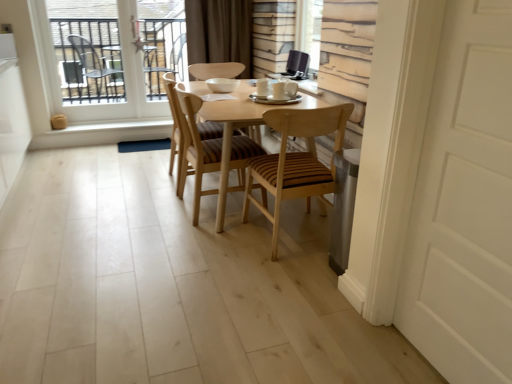
Locate an element on the screen. This screenshot has height=384, width=512. brown fabric curtain at upper center is located at coordinates (220, 32).

What do you see at coordinates (295, 161) in the screenshot? The height and width of the screenshot is (384, 512). I see `wooden striped chair at center, marked as the third chair in a left-to-right arrangement` at bounding box center [295, 161].

You are a GUI agent. You are given a task and a screenshot of the screen. Output one action in this format:
    pyautogui.click(x=<x>, y=<y>)
    Task: Click on the wooden table at center
    
    Given the screenshot: What is the action you would take?
    pyautogui.click(x=232, y=131)

The image size is (512, 384). I want to click on white matte door at center, so click(x=464, y=204).

What do you see at coordinates (309, 30) in the screenshot?
I see `wooden slats at upper center` at bounding box center [309, 30].

Locate an element on the screen. Image resolution: width=512 pixels, height=384 pixels. woodenchair at center, placed as the 2th chair when sorted from left to right is located at coordinates (198, 147).

Considering the sizes of objects brown fabric curtain at upper center and white matte door at center in the image provided, who is bigger, brown fabric curtain at upper center or white matte door at center?

With larger size is brown fabric curtain at upper center.

Is brown fabric curtain at upper center oriented away from white matte door at center?

That's not correct — brown fabric curtain at upper center is not looking away from white matte door at center.

Which object is closer to the camera taking this photo, brown fabric curtain at upper center or white matte door at center?

white matte door at center is closer to the camera.

From a real-world perspective, is brown fabric curtain at upper center physically above white matte door at center?

Indeed, from a real-world perspective, brown fabric curtain at upper center stands above white matte door at center.

From a real-world perspective, does wooden striped chair at center, the 1th chair when ordered from right to left, sit lower than clear glass window at upper left?

Correct, in the physical world, wooden striped chair at center, the 1th chair when ordered from right to left, is lower than clear glass window at upper left.

Between wooden striped chair at center, the 1th chair when ordered from right to left, and clear glass window at upper left, which one has more height?

clear glass window at upper left is taller.

From the image's perspective, is clear glass window at upper left on top of wooden slats at upper center?

Yes.

Is clear glass window at upper left oriented away from wooden slats at upper center?

clear glass window at upper left is not turned away from wooden slats at upper center.

Between clear glass window at upper left and wooden slats at upper center, which one is positioned behind?

clear glass window at upper left is more distant.

From a real-world perspective, is clear glass window at upper left positioned above or below wooden slats at upper center?

Clearly, from a real-world perspective, clear glass window at upper left is below wooden slats at upper center.

From a real-world perspective, is white matte door at center positioned under wooden slats at upper center based on gravity?

Correct, in the physical world, white matte door at center is lower than wooden slats at upper center.

Is white matte door at center oriented away from wooden slats at upper center?

That's not correct — white matte door at center is not looking away from wooden slats at upper center.

Is white matte door at center beside wooden slats at upper center?

No, white matte door at center is not making contact with wooden slats at upper center.

Locate an element on the screen. door in front of the wooden slats at upper center is located at coordinates (464, 204).

Is clear glass window at upper left looking in the opposite direction of brown fabric curtain at upper center?

That's not correct — clear glass window at upper left is not looking away from brown fabric curtain at upper center.

Is clear glass window at upper left far from brown fabric curtain at upper center?

No, clear glass window at upper left is not far from brown fabric curtain at upper center.

Considering the positions of objects clear glass window at upper left and brown fabric curtain at upper center in the image provided, who is more to the left, clear glass window at upper left or brown fabric curtain at upper center?

Positioned to the left is clear glass window at upper left.

Is clear glass window at upper left spatially inside brown fabric curtain at upper center, or outside of it?

clear glass window at upper left exists outside the volume of brown fabric curtain at upper center.

Is the surface of wooden slats at upper center in direct contact with woodenchair at center, placed as the 2th chair when sorted from left to right?

There is a gap between wooden slats at upper center and woodenchair at center, placed as the 2th chair when sorted from left to right.

From a real-world perspective, is wooden slats at upper center physically below woodenchair at center, the 2th chair from the right?

Incorrect, from a real-world perspective, wooden slats at upper center is higher than woodenchair at center, the 2th chair from the right.

Could you tell me if woodenchair at center, the 2th chair from the right, is facing wooden slats at upper center?

No, woodenchair at center, the 2th chair from the right, is not facing towards wooden slats at upper center.

Relative to wooden slats at upper center, is woodenchair at center, placed as the 2th chair when sorted from left to right, in front or behind?

Visually, woodenchair at center, placed as the 2th chair when sorted from left to right, is located in front of wooden slats at upper center.

At what (x,y) coordinates should I click in order to perform the action: click on chair that is the 2nd one when counting forward from the wooden slats at upper center. Please return your answer as a coordinate pair (x, y). The width and height of the screenshot is (512, 384). Looking at the image, I should click on [x=198, y=147].

Between woodenchair at center, the 2th chair from the right, and wooden slats at upper center, which one has smaller size?

With smaller size is wooden slats at upper center.

The width and height of the screenshot is (512, 384). I want to click on door below the brown fabric curtain at upper center (from a real-world perspective), so click(464, 204).

Image resolution: width=512 pixels, height=384 pixels. I want to click on window on the left of wooden striped chair at center, the 1th chair when ordered from right to left, so click(98, 78).

Looking at this image, looking at the image, which one is located closer to wooden slats at upper center, brown fabric curtain at upper center or white matte door at center?

The object closer to wooden slats at upper center is brown fabric curtain at upper center.

Considering their positions, is woodenchair at center, the 2th chair from the right, positioned further to brown fabric curtain at upper center than wooden striped chair at center, the 1th chair when ordered from right to left?

wooden striped chair at center, the 1th chair when ordered from right to left, lies further to brown fabric curtain at upper center than the other object.

Looking at the image, which one is located closer to wooden striped chair at center, marked as the third chair in a left-to-right arrangement, wooden at center, which is the 3th chair in right-to-left order, or wooden table at center?

wooden table at center is positioned closer to the anchor wooden striped chair at center, marked as the third chair in a left-to-right arrangement.

Which object lies further to the anchor point wooden at center, which is the 1th chair from left to right, wooden slats at upper center or woodenchair at center, the 2th chair from the right?

wooden slats at upper center is further to wooden at center, which is the 1th chair from left to right.

Based on their spatial positions, is wooden striped chair at center, marked as the third chair in a left-to-right arrangement, or white matte door at center further from woodenchair at center, placed as the 2th chair when sorted from left to right?

Among the two, white matte door at center is located further to woodenchair at center, placed as the 2th chair when sorted from left to right.

Based on their spatial positions, is woodenchair at center, placed as the 2th chair when sorted from left to right, or clear glass window at upper left closer to wooden slats at upper center?

woodenchair at center, placed as the 2th chair when sorted from left to right, is closer to wooden slats at upper center.

Based on their spatial positions, is wooden table at center or clear glass window at upper left closer to wooden striped chair at center, the 1th chair when ordered from right to left?

Among the two, wooden table at center is located nearer to wooden striped chair at center, the 1th chair when ordered from right to left.

When comparing their distances from wooden at center, which is the 3th chair in right-to-left order, does wooden striped chair at center, the 1th chair when ordered from right to left, or wooden table at center seem closer?

wooden table at center is positioned closer to the anchor wooden at center, which is the 3th chair in right-to-left order.

Where is `window located between woodenchair at center, the 2th chair from the right, and brown fabric curtain at upper center in the depth direction`? This screenshot has height=384, width=512. window located between woodenchair at center, the 2th chair from the right, and brown fabric curtain at upper center in the depth direction is located at coordinates (98, 78).

Locate an element on the screen. This screenshot has height=384, width=512. window screen between wooden striped chair at center, the 1th chair when ordered from right to left, and brown fabric curtain at upper center from front to back is located at coordinates point(309,30).

Locate an element on the screen. kitchen & dining room table between wooden slats at upper center and woodenchair at center, the 2th chair from the right, in the up-down direction is located at coordinates (232, 131).

The image size is (512, 384). I want to click on kitchen & dining room table located between white matte door at center and brown fabric curtain at upper center in the depth direction, so click(x=232, y=131).